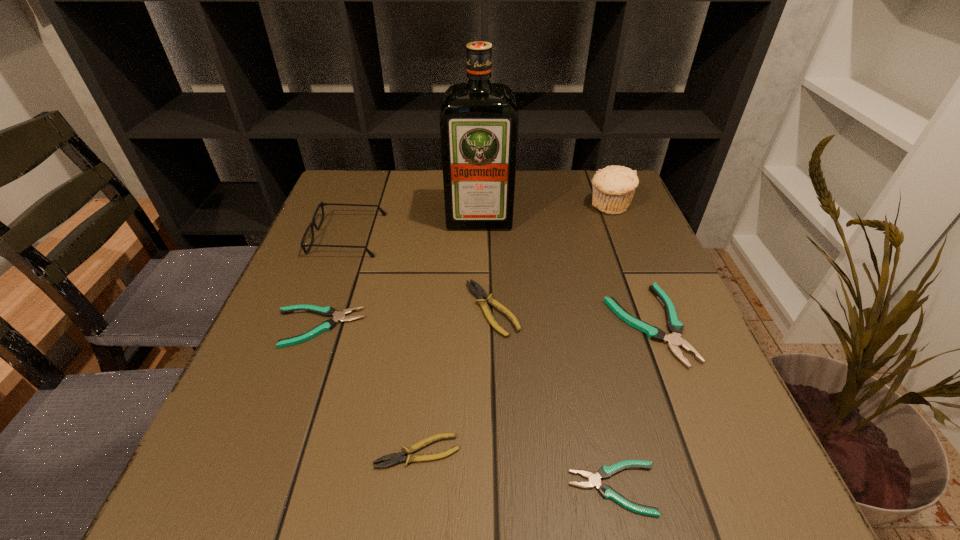
Locate an element on the screen. Image resolution: width=960 pixels, height=540 pixels. pliers that is the second nearest to the beige muffin is located at coordinates (477, 291).

Identify which pliers is the closest to the bigger yellow pliers. Please provide its 2D coordinates. Your answer should be formatted as a tuple, i.e. [(x, y)], where the tuple contains the x and y coordinates of a point satisfying the conditions above.

[(674, 339)]

Select which teal pliers is the second closest to the smallest teal pliers. Please provide its 2D coordinates. Your answer should be formatted as a tuple, i.e. [(x, y)], where the tuple contains the x and y coordinates of a point satisfying the conditions above.

[(327, 311)]

Select which teal pliers appears as the closest to the sixth object from left to right. Please provide its 2D coordinates. Your answer should be formatted as a tuple, i.e. [(x, y)], where the tuple contains the x and y coordinates of a point satisfying the conditions above.

[(674, 339)]

This screenshot has height=540, width=960. In order to click on vacant region that satisfies the following two spatial constraints: 1. on the back side of the smaller yellow pliers; 2. on the left side of the muffin in this screenshot , I will do `click(444, 206)`.